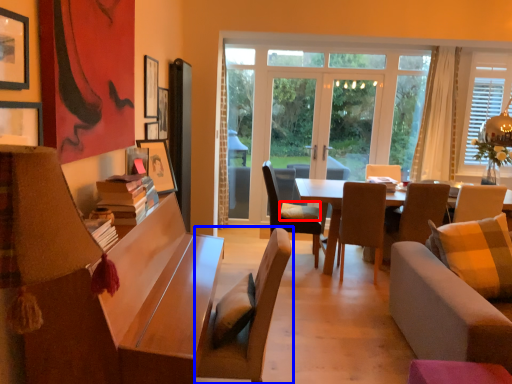
Question: Which object is closer to the camera taking this photo, pillow (highlighted by a red box) or chair (highlighted by a blue box)?

Choices:
 (A) pillow
 (B) chair

Answer: (B)